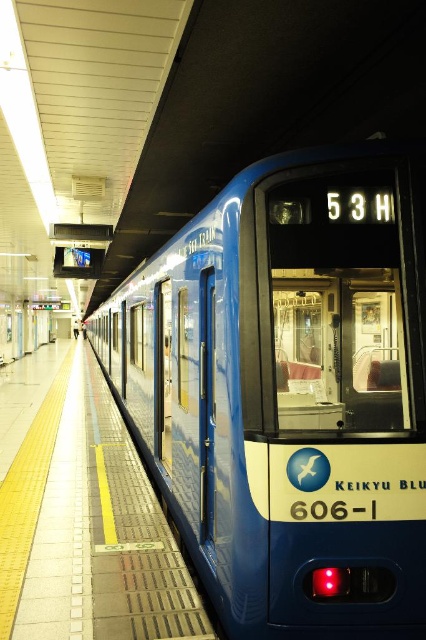
You are standing on the platform at the train station. You see a point marked at coordinate (290, 390). What object is located at that point?

The point at coordinate (290, 390) indicates the blue glossy train at center.

You are a passenger waiting at the train station. You see the blue glossy train at center and the yellow rubber platform at center. Which object is closer to the edge of the platform?

The yellow rubber platform at center is closer to the edge of the platform since the blue glossy train at center is positioned on its right side.